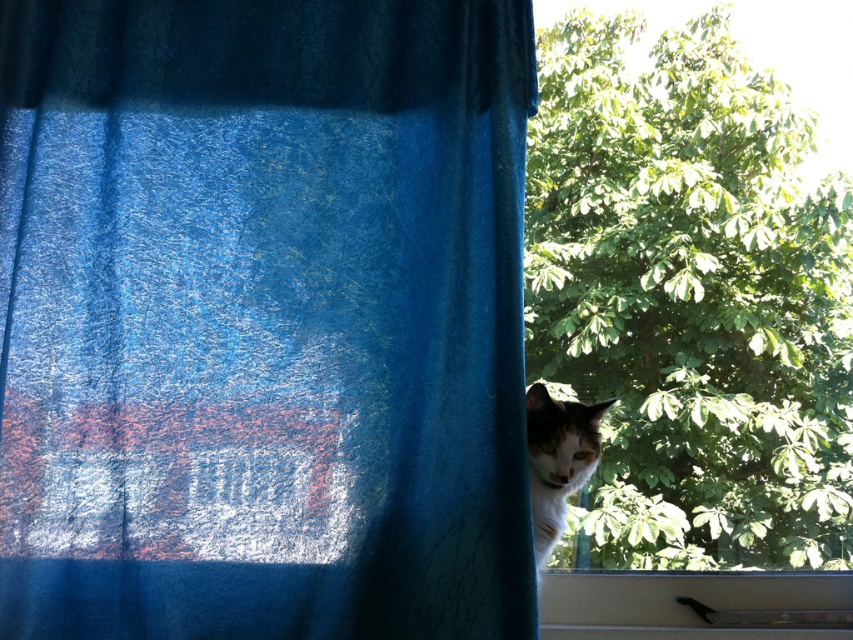
You are standing in the room and want to open the window to let in more light. The blue velvet curtain at center is blocking part of the window. Where should you move the curtain to allow more light through the window?

The blue velvet curtain at center is located at point (x=263, y=320), so you should move it to the side away from the window frame to allow more light through.

You are holding a camera and want to take a photo of the blue velvet curtain at center. If you are standing 4.02 feet away from it, is the distance sufficient to capture the entire curtain in the frame?

The blue velvet curtain at center and camera are 4.02 feet apart from each other. This distance is sufficient to capture the entire curtain in the frame as the camera is positioned at the recommended distance for such shots.

You are a delivery robot with a package that is 24 inches wide. You need to pass through the space between the blue velvet curtain at center and the transparent glass window at center. Will your package fit through that space?

The space between the blue velvet curtain at center and the transparent glass window at center is 20.96 inches. Since your package is 24 inches wide, it is wider than the available space, so it will not fit through.